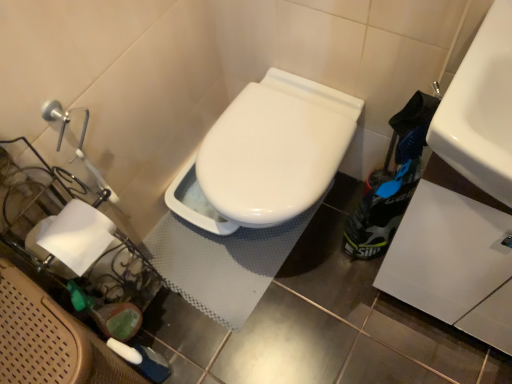
What is the approximate height of white glossy sink at upper right?

white glossy sink at upper right is 6.24 inches tall.

I want to click on white textured bath mat at center, so click(222, 263).

Where is `white glossy sink at upper right`? white glossy sink at upper right is located at coordinates (481, 109).

Between white paper at left and white glossy sink at upper right, which one has more height?

white glossy sink at upper right.

Is white paper at left looking in the opposite direction of white glossy sink at upper right?

No, white paper at left is not facing the opposite direction of white glossy sink at upper right.

Considering the positions of point (32, 243) and point (504, 182), is point (32, 243) closer or farther from the camera than point (504, 182)?

Point (32, 243) is farther from the camera than point (504, 182).

Which object is thinner, white paper at left or white glossy sink at upper right?

With smaller width is white paper at left.

Could you tell me if white textured bath mat at center is turned towards white glossy sink at upper right?

No, white textured bath mat at center is not turned towards white glossy sink at upper right.

Is white textured bath mat at center wider than white glossy sink at upper right?

Yes.

Is the surface of white textured bath mat at center in direct contact with white glossy sink at upper right?

white textured bath mat at center and white glossy sink at upper right are not in contact.

Between point (227, 309) and point (476, 142), which one is positioned in front?

The point (476, 142) is closer to the camera.

Consider the image. From a real-world perspective, does white glossy sink at upper right sit lower than white paper at left?

No.

What's the angular difference between white glossy sink at upper right and white paper at left's facing directions?

89.6 degrees.

Could you tell me if white glossy sink at upper right is facing white paper at left?

No, white glossy sink at upper right is not oriented towards white paper at left.

Which of these two, white glossy sink at upper right or white paper at left, stands taller?

white glossy sink at upper right.

Is white textured bath mat at center placed right next to white paper at left?

white textured bath mat at center and white paper at left are clearly separated.

I want to click on bath mat on the right of the white paper at left, so click(x=222, y=263).

From a real-world perspective, is white textured bath mat at center physically above white paper at left?

Actually, white textured bath mat at center is physically below white paper at left in the real world.

Could you tell me if white textured bath mat at center is facing white paper at left?

No, white textured bath mat at center is not facing towards white paper at left.

Is white glossy sink at upper right at the left side of white textured bath mat at center?

No, white glossy sink at upper right is not to the left of white textured bath mat at center.

Considering the sizes of white glossy sink at upper right and white textured bath mat at center in the image, is white glossy sink at upper right taller or shorter than white textured bath mat at center?

white glossy sink at upper right is taller than white textured bath mat at center.

Which is in front, point (505, 192) or point (174, 247)?

Point (505, 192)

From the picture: Is white glossy sink at upper right bigger than white textured bath mat at center?

Actually, white glossy sink at upper right might be smaller than white textured bath mat at center.

From the image's perspective, who appears lower, white paper at left or white textured bath mat at center?

white paper at left.

Which is nearer, (87, 237) or (162, 272)?

Point (87, 237) is positioned closer to the camera compared to point (162, 272).

Considering the relative sizes of white paper at left and white textured bath mat at center in the image provided, is white paper at left smaller than white textured bath mat at center?

Yes.

Is the surface of white paper at left in direct contact with white textured bath mat at center?

No, white paper at left is not touching white textured bath mat at center.

At what (x,y) coordinates should I click in order to perform the action: click on sink on the right of white paper at left. Please return your answer as a coordinate pair (x, y). Looking at the image, I should click on (481, 109).

Find the location of a particular element. The image size is (512, 384). bath mat to the left of white glossy sink at upper right is located at coordinates (222, 263).

When comparing their distances from white paper at left, does white glossy sink at upper right or white textured bath mat at center seem further?

white glossy sink at upper right.

Estimate the real-world distances between objects in this image. Which object is further from white paper at left, white textured bath mat at center or white glossy sink at upper right?

The object further to white paper at left is white glossy sink at upper right.

Looking at the image, which one is located closer to white glossy sink at upper right, white paper at left or white textured bath mat at center?

white paper at left is positioned closer to the anchor white glossy sink at upper right.

When comparing their distances from white glossy sink at upper right, does white textured bath mat at center or white paper at left seem closer?

white paper at left lies closer to white glossy sink at upper right than the other object.

Consider the image. Based on their spatial positions, is white paper at left or white glossy sink at upper right closer to white textured bath mat at center?

white paper at left is closer to white textured bath mat at center.

Based on their spatial positions, is white glossy sink at upper right or white paper at left further from white textured bath mat at center?

white glossy sink at upper right.

The height and width of the screenshot is (384, 512). I want to click on toilet paper positioned between white glossy sink at upper right and white textured bath mat at center from near to far, so click(x=75, y=236).